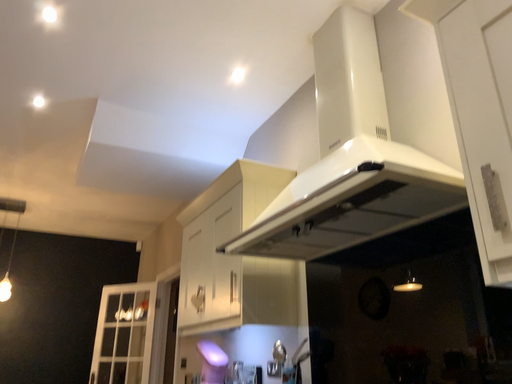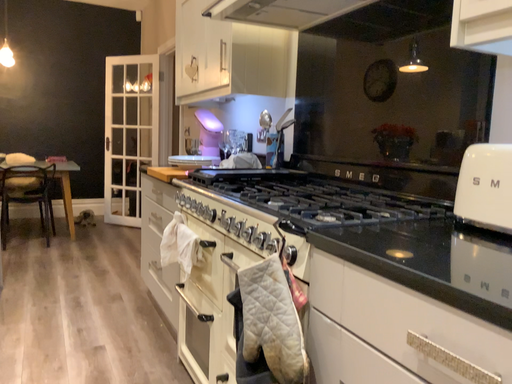
Question: How did the camera likely rotate when shooting the video?

Choices:
 (A) rotated upward
 (B) rotated downward

Answer: (B)